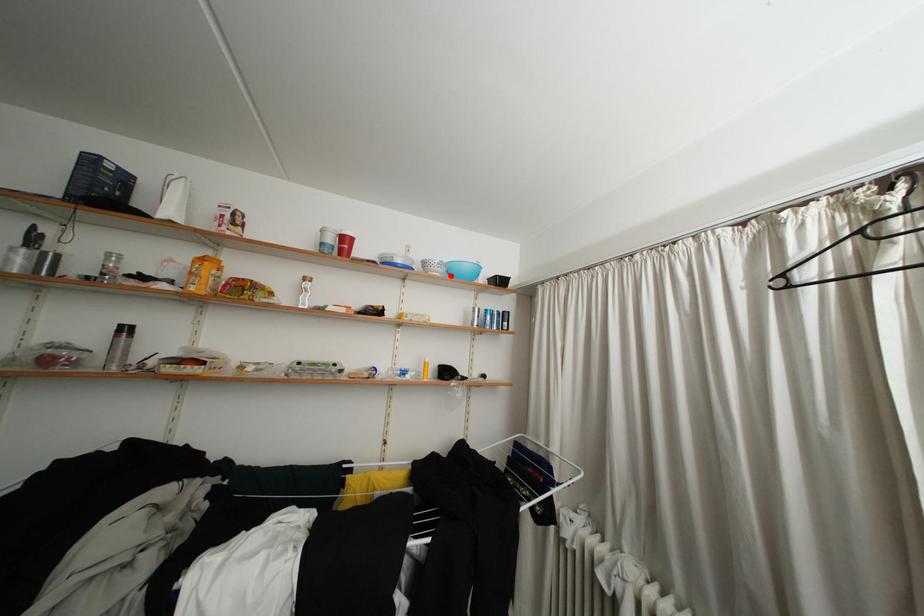
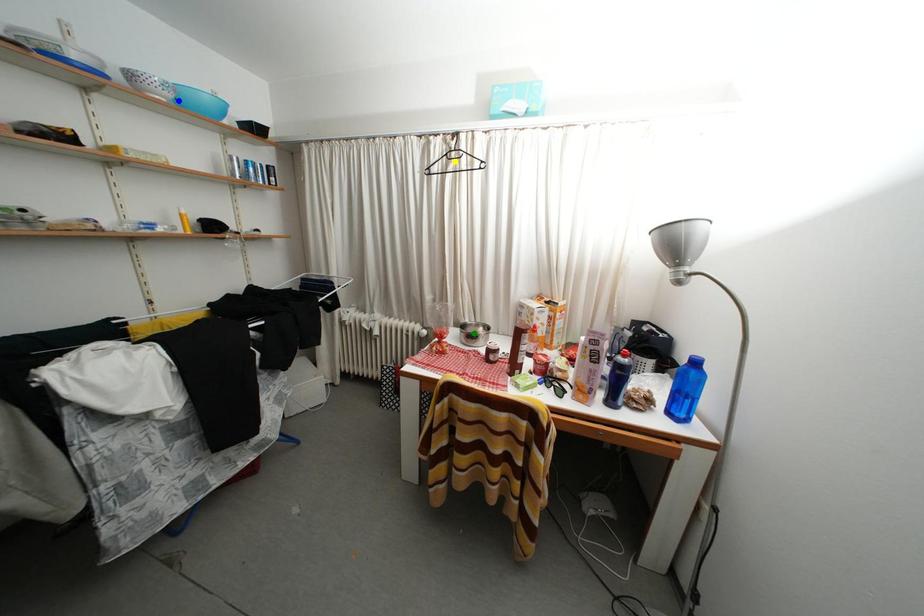
Question: I am providing you with two images of the same scene from different viewpoints. A red point is marked on the first image. You are given multiple points on the second image. In image 2, which mark is for the same physical point as the one in image 1?

Choices:
 (A) yellow point
 (B) green point
 (C) blue point

Answer: (C)